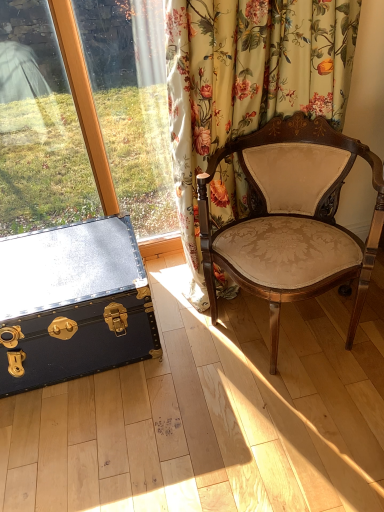
What is the approximate height of velvet beige chair at center?

velvet beige chair at center is 71.75 centimeters in height.

Where is `floral fabric curtain at upper right`? Image resolution: width=384 pixels, height=512 pixels. floral fabric curtain at upper right is located at coordinates (247, 83).

Find the location of `velvet beige chair at center`. velvet beige chair at center is located at coordinates (291, 218).

Considering the points (307, 9) and (234, 239), which point is behind, point (307, 9) or point (234, 239)?

The point (234, 239) is farther from the camera.

From a real-world perspective, is floral fabric curtain at upper right located higher than velvet beige chair at center?

Yes.

Is floral fabric curtain at upper right at the left side of velvet beige chair at center?

Indeed, floral fabric curtain at upper right is positioned on the left side of velvet beige chair at center.

Would you consider black leather trunk at lower left to be distant from velvet beige chair at center?

No, black leather trunk at lower left is not far from velvet beige chair at center.

In the scene shown: Could you tell me if black leather trunk at lower left is turned towards velvet beige chair at center?

No, black leather trunk at lower left is not facing towards velvet beige chair at center.

Considering the sizes of objects black leather trunk at lower left and velvet beige chair at center in the image provided, who is shorter, black leather trunk at lower left or velvet beige chair at center?

With less height is black leather trunk at lower left.

Is black leather trunk at lower left situated inside velvet beige chair at center or outside?

black leather trunk at lower left is not inside velvet beige chair at center, it's outside.

Between floral fabric curtain at upper right and black leather trunk at lower left, which one has larger width?

Wider between the two is black leather trunk at lower left.

You are a GUI agent. You are given a task and a screenshot of the screen. Output one action in this format:
    pyautogui.click(x=<x>, y=<y>)
    Task: Click on the curtain in front of the black leather trunk at lower left
    
    Given the screenshot: What is the action you would take?
    pyautogui.click(x=247, y=83)

Based on the photo, would you say floral fabric curtain at upper right is a long distance from black leather trunk at lower left?

floral fabric curtain at upper right is near black leather trunk at lower left, not far away.

From a real-world perspective, is floral fabric curtain at upper right physically below black leather trunk at lower left?

Incorrect, from a real-world perspective, floral fabric curtain at upper right is higher than black leather trunk at lower left.

Consider the image. Is black leather trunk at lower left positioned with its back to floral fabric curtain at upper right?

black leather trunk at lower left is not turned away from floral fabric curtain at upper right.

From a real-world perspective, is black leather trunk at lower left above or below floral fabric curtain at upper right?

black leather trunk at lower left is below floral fabric curtain at upper right.

Is floral fabric curtain at upper right surrounded by black leather trunk at lower left?

That's incorrect, floral fabric curtain at upper right is not inside black leather trunk at lower left.

Is the surface of black leather trunk at lower left in direct contact with floral fabric curtain at upper right?

No, black leather trunk at lower left is not making contact with floral fabric curtain at upper right.

Is velvet beige chair at center not close to black leather trunk at lower left?

No, velvet beige chair at center is not far from black leather trunk at lower left.

Can you confirm if velvet beige chair at center is wider than black leather trunk at lower left?

Yes.

From the image's perspective, who appears lower, velvet beige chair at center or black leather trunk at lower left?

black leather trunk at lower left appears lower in the image.

Is velvet beige chair at center outside of black leather trunk at lower left?

velvet beige chair at center lies outside black leather trunk at lower left's area.

Would you say velvet beige chair at center is inside or outside floral fabric curtain at upper right?

The correct answer is: outside.

From their relative heights in the image, would you say velvet beige chair at center is taller or shorter than floral fabric curtain at upper right?

velvet beige chair at center is shorter than floral fabric curtain at upper right.

From the image's perspective, is velvet beige chair at center positioned above or below floral fabric curtain at upper right?

Based on their image positions, velvet beige chair at center is located beneath floral fabric curtain at upper right.

At what (x,y) coordinates should I click in order to perform the action: click on curtain above the velvet beige chair at center (from the image's perspective). Please return your answer as a coordinate pair (x, y). This screenshot has height=512, width=384. Looking at the image, I should click on (247, 83).

Find the location of `box that appears below the velvet beige chair at center (from a real-world perspective)`. box that appears below the velvet beige chair at center (from a real-world perspective) is located at coordinates click(73, 304).

From the image, which object appears to be farther from floral fabric curtain at upper right, black leather trunk at lower left or velvet beige chair at center?

black leather trunk at lower left is further to floral fabric curtain at upper right.

Considering their positions, is floral fabric curtain at upper right positioned further to black leather trunk at lower left than velvet beige chair at center?

floral fabric curtain at upper right is positioned further to the anchor black leather trunk at lower left.

Which object lies nearer to the anchor point velvet beige chair at center, black leather trunk at lower left or floral fabric curtain at upper right?

The object closer to velvet beige chair at center is floral fabric curtain at upper right.

Based on their spatial positions, is velvet beige chair at center or floral fabric curtain at upper right further from black leather trunk at lower left?

floral fabric curtain at upper right is further to black leather trunk at lower left.

Estimate the real-world distances between objects in this image. Which object is further from velvet beige chair at center, floral fabric curtain at upper right or black leather trunk at lower left?

Among the two, black leather trunk at lower left is located further to velvet beige chair at center.

Considering their positions, is velvet beige chair at center positioned closer to floral fabric curtain at upper right than black leather trunk at lower left?

velvet beige chair at center.

Find the location of a particular element. This screenshot has height=512, width=384. curtain between black leather trunk at lower left and velvet beige chair at center is located at coordinates (247, 83).